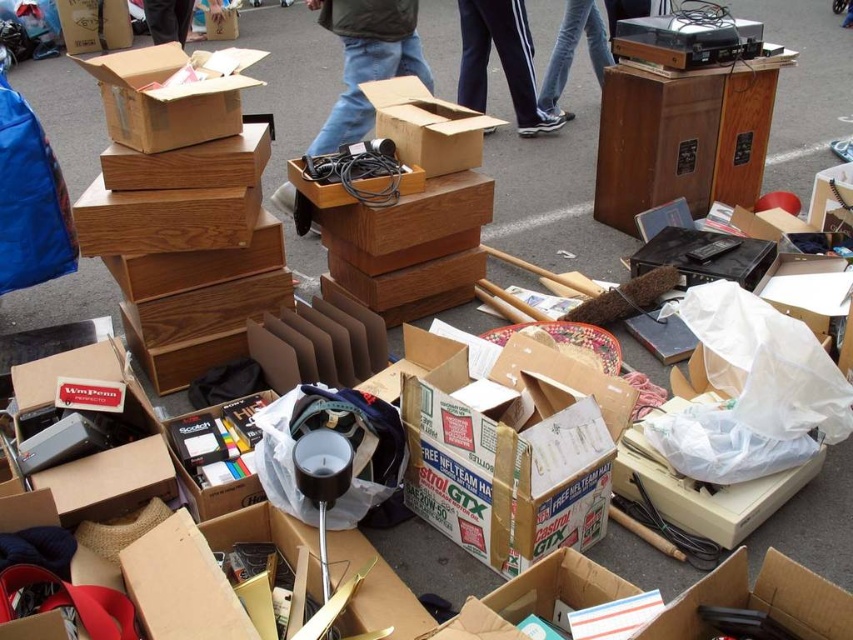
Question: Estimate the real-world distances between objects in this image. Which object is farther from the dark brown leather jacket at center?

Choices:
 (A) jeans at upper center
 (B) cardboard box at center
 (C) matte cardboard box at center
 (D) matte brown box at center

Answer: (D)

Question: Is dark blue jeans at center to the left of jeans at upper center from the viewer's perspective?

Choices:
 (A) no
 (B) yes

Answer: (B)

Question: Does matte brown box at center appear on the left side of wooden box at center?

Choices:
 (A) no
 (B) yes

Answer: (B)

Question: Can you confirm if dark blue jeans at center is positioned below jeans at upper center?

Choices:
 (A) no
 (B) yes

Answer: (B)

Question: Which of these objects is positioned closest to the cardboard box at center?

Choices:
 (A) matte cardboard box at center
 (B) dark brown leather jacket at center
 (C) dark blue jeans at center

Answer: (A)

Question: Estimate the real-world distances between objects in this image. Which object is closer to the dark brown leather jacket at center?

Choices:
 (A) dark blue jeans at center
 (B) cardboard box at center
 (C) jeans at upper center
 (D) wooden box at center

Answer: (A)